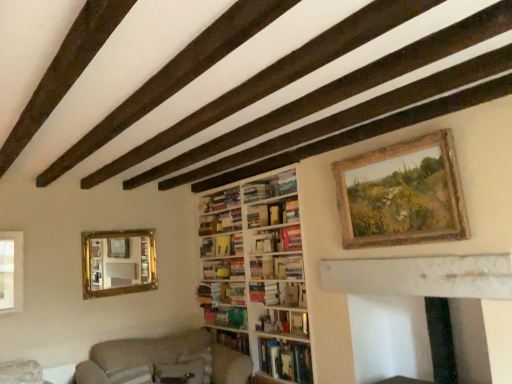
Question: Considering the positions of hardcover book at center, which is counted as the 7th book, starting from the top, and wooden rustic frame at upper right in the image, is hardcover book at center, which is counted as the 7th book, starting from the top, wider or thinner than wooden rustic frame at upper right?

Choices:
 (A) thin
 (B) wide

Answer: (B)

Question: Considering the positions of point (279, 314) and point (458, 233), is point (279, 314) closer or farther from the camera than point (458, 233)?

Choices:
 (A) farther
 (B) closer

Answer: (A)

Question: Which is farther from the wooden bookshelf at center?

Choices:
 (A) hardcover book at center, which is counted as the 3th book, starting from the bottom
 (B) hardcover book at center, which is counted as the sixth book, starting from the top
 (C) gold-framed mirror at left
 (D) green matte book at center, acting as the second book starting from the bottom
 (E) hardcover book at upper center, the 9th book positioned from the bottom

Answer: (E)

Question: Estimate the real-world distances between objects in this image. Which object is farther from the beige fabric couch at lower left?

Choices:
 (A) white wooden bookcase at center
 (B) gold-framed mirror at left
 (C) hardcover book at center, marked as the 9th book in a top-to-bottom arrangement
 (D) hardcover books at center, marked as the seventh book in a bottom-to-top arrangement
 (E) green matte book at center, acting as the second book starting from the bottom

Answer: (D)